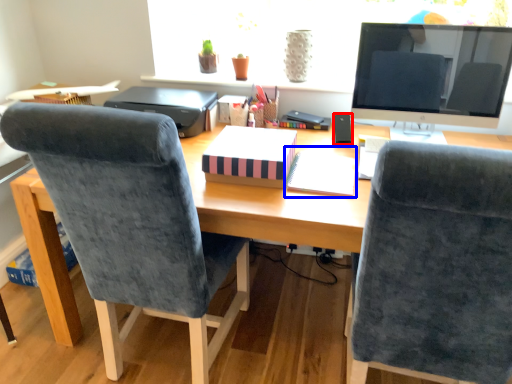
Question: Which point is further to the camera, speaker (highlighted by a red box) or notebook (highlighted by a blue box)?

Choices:
 (A) speaker
 (B) notebook

Answer: (A)